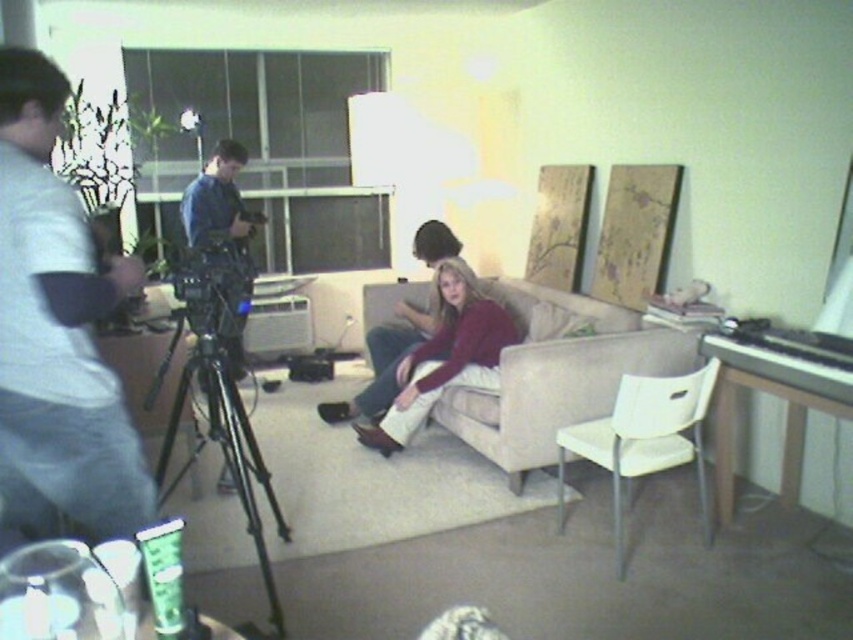
Question: Estimate the real-world distances between objects in this image. Which object is farther from the black matte tripod at lower left?

Choices:
 (A) black polished piano at right
 (B) beige fabric couch at center
 (C) matte burgundy sweater at center
 (D) gray cotton shirt at left

Answer: (A)

Question: Does gray cotton shirt at left have a greater width compared to black polished piano at right?

Choices:
 (A) yes
 (B) no

Answer: (B)

Question: In this image, where is white plastic chair at center located relative to blue denim shirt at center?

Choices:
 (A) below
 (B) above

Answer: (A)

Question: Can you confirm if black polished piano at right is bigger than blue denim shirt at center?

Choices:
 (A) yes
 (B) no

Answer: (B)

Question: Which of the following is the closest to the observer?

Choices:
 (A) beige fabric couch at center
 (B) black polished piano at right
 (C) blue denim shirt at center
 (D) white plastic chair at center

Answer: (B)

Question: Among these objects, which one is farthest from the camera?

Choices:
 (A) gray cotton shirt at left
 (B) black polished piano at right

Answer: (B)